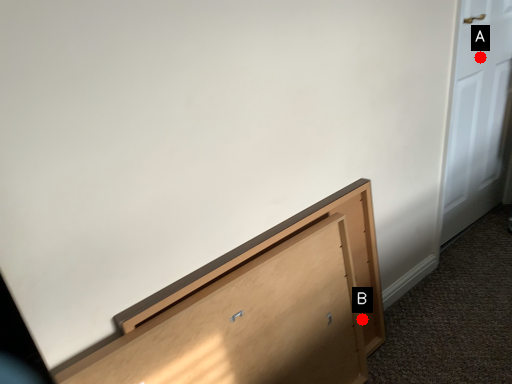
Question: Two points are circled on the image, labeled by A and B beside each circle. Which point is farther from the camera taking this photo?

Choices:
 (A) A is further
 (B) B is further

Answer: (A)